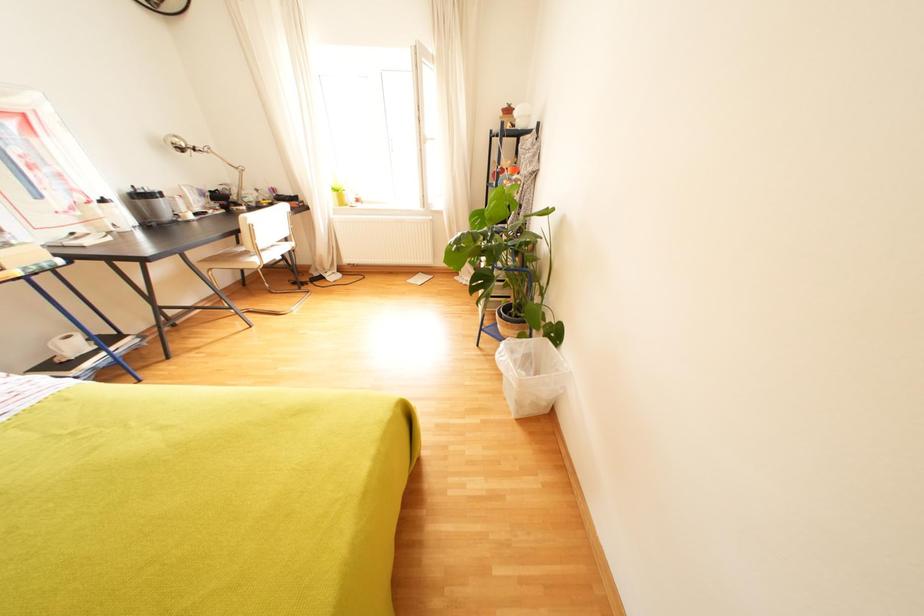
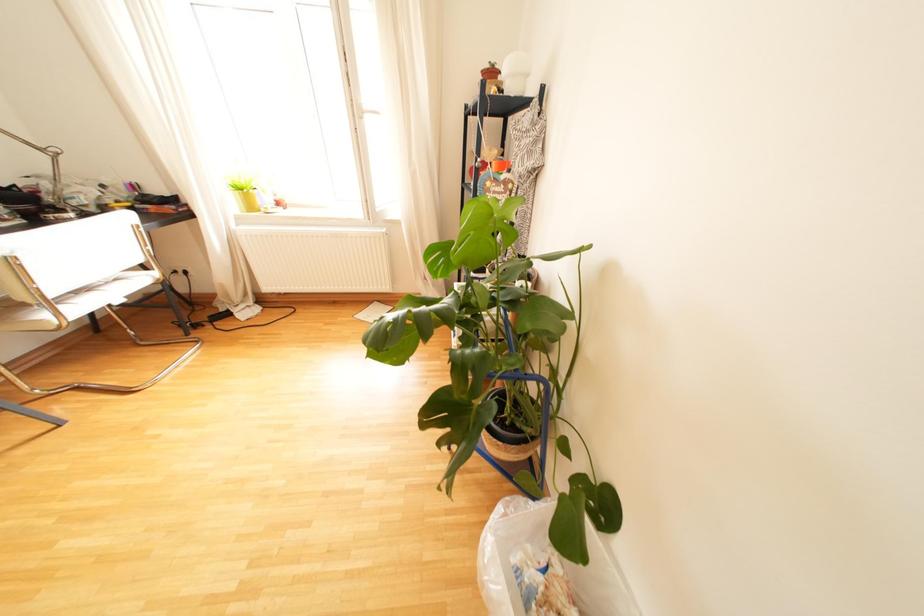
Question: Based on the continuous images, in which direction is the camera rotating? Reply with the corresponding letter.

Choices:
 (A) Left
 (B) Right
 (C) Up
 (D) Down

Answer: (B)